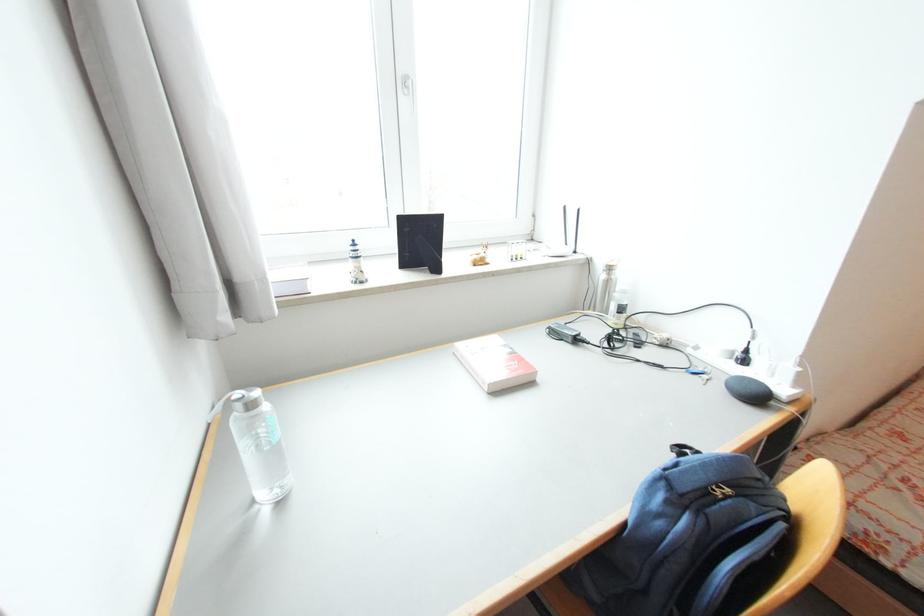
Image resolution: width=924 pixels, height=616 pixels. Describe the element at coordinates (721, 491) in the screenshot. I see `the gold zipper pull` at that location.